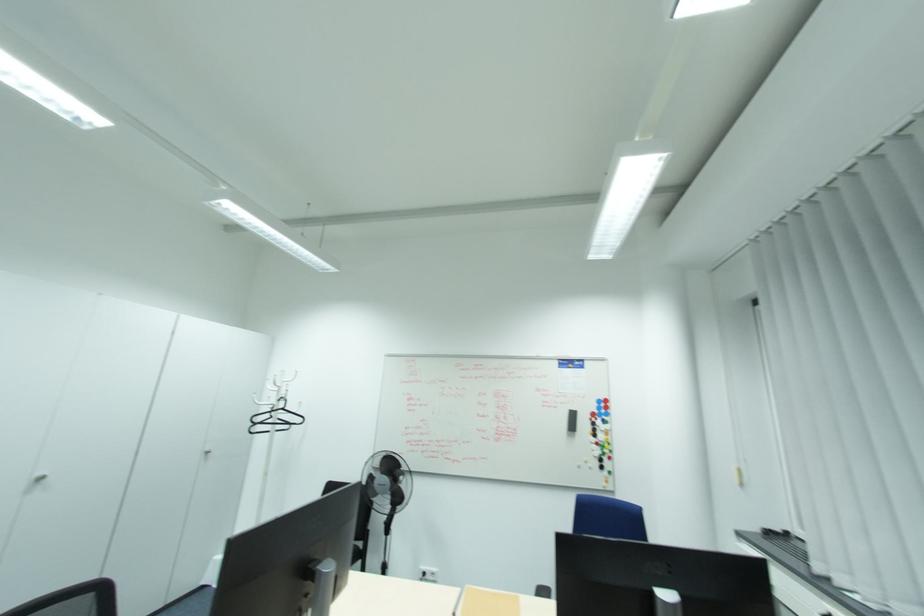
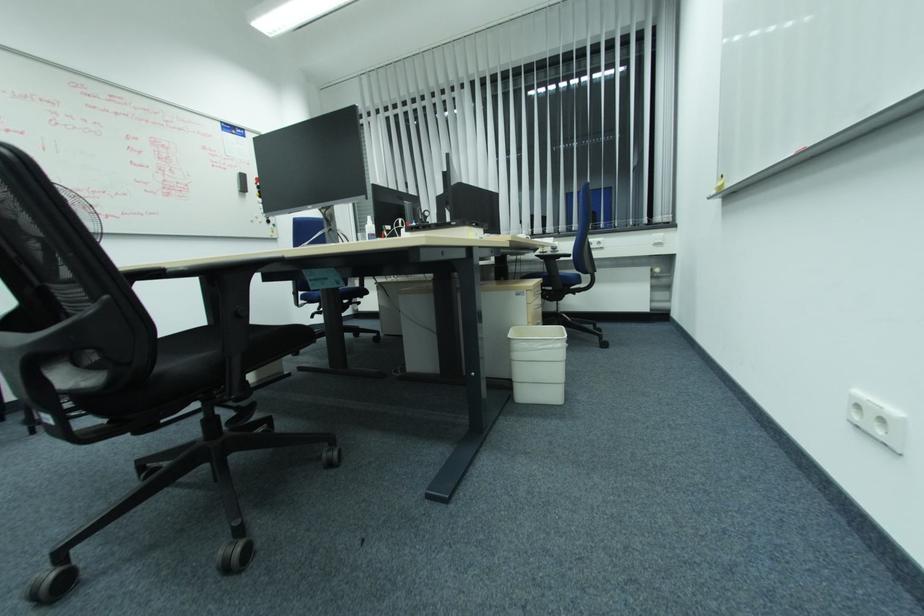
Locate, in the second image, the point that corresponds to point (574, 416) in the first image.

(244, 177)